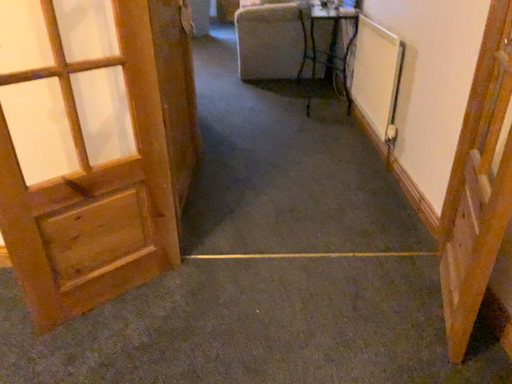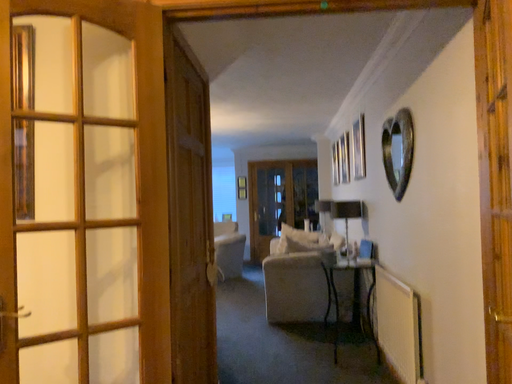
Question: Which way did the camera rotate in the video?

Choices:
 (A) rotated upward
 (B) rotated downward

Answer: (A)